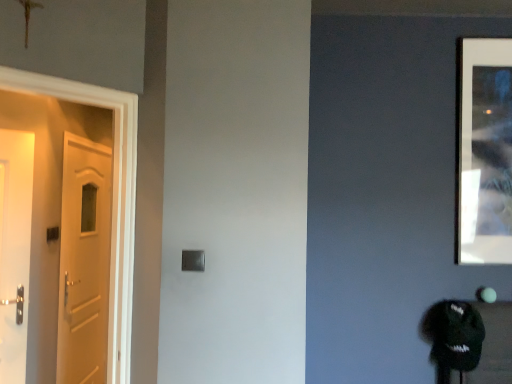
Question: Considering the positions of metallic silver frame at upper right and white glossy door at left in the image, is metallic silver frame at upper right wider or thinner than white glossy door at left?

Choices:
 (A) thin
 (B) wide

Answer: (A)

Question: Looking at the image, does metallic silver frame at upper right seem bigger or smaller compared to white glossy door at left?

Choices:
 (A) small
 (B) big

Answer: (A)

Question: Relative to white glossy door at left, is metallic silver frame at upper right in front or behind?

Choices:
 (A) front
 (B) behind

Answer: (B)

Question: In the image, is white glossy door at left positioned in front of or behind metallic silver frame at upper right?

Choices:
 (A) front
 (B) behind

Answer: (A)

Question: Based on their positions, is white glossy door at left located to the left or right of metallic silver frame at upper right?

Choices:
 (A) right
 (B) left

Answer: (B)

Question: From a real-world perspective, is white glossy door at left above or below metallic silver frame at upper right?

Choices:
 (A) above
 (B) below

Answer: (B)

Question: From their relative heights in the image, would you say white glossy door at left is taller or shorter than metallic silver frame at upper right?

Choices:
 (A) tall
 (B) short

Answer: (A)